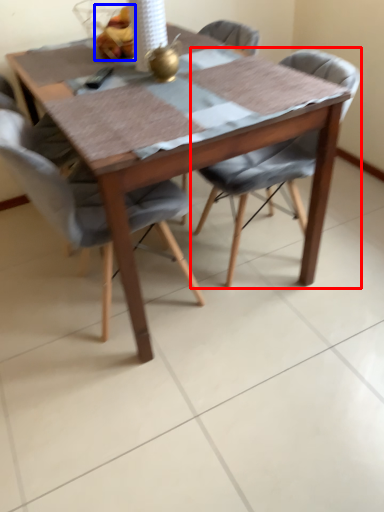
Question: Which object is further to the camera taking this photo, chair (highlighted by a red box) or food (highlighted by a blue box)?

Choices:
 (A) chair
 (B) food

Answer: (B)